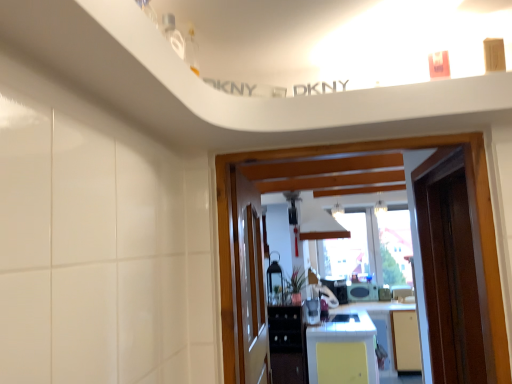
Measure the distance between point (313, 303) and camera.

16.98 feet.

Identify the location of wooden door at center, the second door positioned from the right. This screenshot has height=384, width=512. (249, 282).

The width and height of the screenshot is (512, 384). What do you see at coordinates (275, 282) in the screenshot?
I see `metallic lantern at center, which is the third appliance from back to front` at bounding box center [275, 282].

Where is `white glossy exhaust hood at upper center`? white glossy exhaust hood at upper center is located at coordinates (319, 223).

Locate an element on the screen. The image size is (512, 384). metallic silver toaster at center, acting as the 2th appliance starting from the right is located at coordinates (337, 288).

The image size is (512, 384). In order to click on yellow matte countertop at center in this screenshot , I will do `click(343, 350)`.

Locate an element on the screen. metallic silver toaster at center, which is the first appliance in front-to-back order is located at coordinates (312, 311).

Considering their positions, is matte black microwave at center, positioned as the 1th appliance in right-to-left order, located in front of or behind metallic lantern at center, the second appliance viewed from the front?

matte black microwave at center, positioned as the 1th appliance in right-to-left order, is behind metallic lantern at center, the second appliance viewed from the front.

Which object is positioned more to the right, matte black microwave at center, the first appliance viewed from the back, or metallic lantern at center, the 1th appliance in the left-to-right sequence?

matte black microwave at center, the first appliance viewed from the back.

Looking at this image, from the image's perspective, would you say matte black microwave at center, the first appliance viewed from the back, is positioned over metallic lantern at center, the 1th appliance in the left-to-right sequence?

No, from the image's perspective, matte black microwave at center, the first appliance viewed from the back, is not above metallic lantern at center, the 1th appliance in the left-to-right sequence.

Is matte black microwave at center, positioned as the 1th appliance in right-to-left order, positioned beyond the bounds of metallic lantern at center, which is the third appliance from back to front?

That's correct, matte black microwave at center, positioned as the 1th appliance in right-to-left order, is outside of metallic lantern at center, which is the third appliance from back to front.

Looking at this image, is white glossy exhaust hood at upper center to the left of yellow matte countertop at center from the viewer's perspective?

Indeed, white glossy exhaust hood at upper center is positioned on the left side of yellow matte countertop at center.

Consider the image. Could you tell me if white glossy exhaust hood at upper center is facing yellow matte countertop at center?

No.

Is point (300, 224) closer or farther from the camera than point (353, 323)?

Point (300, 224).

Who is taller, white glossy exhaust hood at upper center or yellow matte countertop at center?

Standing taller between the two is yellow matte countertop at center.

Which is less distant, (308, 309) or (252, 211)?

The point (252, 211) is in front.

Considering the positions of objects metallic silver toaster at center, arranged as the 4th appliance when viewed from the back, and wooden door at center, the 1th door viewed from the left, in the image provided, who is more to the left, metallic silver toaster at center, arranged as the 4th appliance when viewed from the back, or wooden door at center, the 1th door viewed from the left,?

Positioned to the left is wooden door at center, the 1th door viewed from the left.

Based on the photo, which of these two, metallic silver toaster at center, which is counted as the 2th appliance, starting from the left, or wooden door at center, the 1th door viewed from the left, is thinner?

Thinner between the two is wooden door at center, the 1th door viewed from the left.

Based on the photo, is metallic silver toaster at center, acting as the 3th appliance starting from the right, next to wooden door at center, the 1th door viewed from the left, and touching it?

No, metallic silver toaster at center, acting as the 3th appliance starting from the right, is not making contact with wooden door at center, the 1th door viewed from the left.

Can you confirm if yellow matte countertop at center is taller than metallic lantern at center, the second appliance viewed from the front?

Indeed, yellow matte countertop at center has a greater height compared to metallic lantern at center, the second appliance viewed from the front.

From a real-world perspective, which object stands above the other?

metallic lantern at center, the second appliance viewed from the front, is physically above.

Considering the positions of point (337, 343) and point (267, 291), is point (337, 343) closer or farther from the camera than point (267, 291)?

Point (337, 343) is positioned closer to the camera compared to point (267, 291).

Which is nearer, (344, 288) or (372, 286)?

Point (344, 288).

Considering the relative positions of metallic silver toaster at center, acting as the 2th appliance starting from the right, and matte black microwave at center, which is the fourth appliance from left to right, in the image provided, is metallic silver toaster at center, acting as the 2th appliance starting from the right, to the left or to the right of matte black microwave at center, which is the fourth appliance from left to right,?

From the image, it's evident that metallic silver toaster at center, acting as the 2th appliance starting from the right, is to the left of matte black microwave at center, which is the fourth appliance from left to right.

I want to click on appliance located below the metallic silver toaster at center, the 3th appliance when ordered from front to back (from the image's perspective), so click(362, 292).

From a real-world perspective, who is located higher, black glossy cabinet at center or wooden door at center, the 1th door viewed from the left?

wooden door at center, the 1th door viewed from the left, from a real-world perspective.

Is black glossy cabinet at center turned away from wooden door at center, the 1th door viewed from the left?

black glossy cabinet at center does not have its back to wooden door at center, the 1th door viewed from the left.

Considering the positions of point (273, 345) and point (238, 186), is point (273, 345) closer or farther from the camera than point (238, 186)?

Point (273, 345) appears to be farther away from the viewer than point (238, 186).

Measure the distance from black glossy cabinet at center to wooden door at center, the second door positioned from the right.

black glossy cabinet at center and wooden door at center, the second door positioned from the right, are 2.70 meters apart.

Is matte black microwave at center, placed as the fourth appliance when sorted from front to back, positioned in front of brown wooden door at right, placed as the 2th door when sorted from left to right?

That is False.

Based on the photo, considering the sizes of objects matte black microwave at center, placed as the fourth appliance when sorted from front to back, and brown wooden door at right, acting as the 1th door starting from the right, in the image provided, who is taller, matte black microwave at center, placed as the fourth appliance when sorted from front to back, or brown wooden door at right, acting as the 1th door starting from the right,?

brown wooden door at right, acting as the 1th door starting from the right.

Does matte black microwave at center, placed as the fourth appliance when sorted from front to back, turn towards brown wooden door at right, acting as the 1th door starting from the right?

Yes, matte black microwave at center, placed as the fourth appliance when sorted from front to back, is aimed at brown wooden door at right, acting as the 1th door starting from the right.

Is matte black microwave at center, placed as the fourth appliance when sorted from front to back, not within brown wooden door at right, placed as the 2th door when sorted from left to right?

Yes, matte black microwave at center, placed as the fourth appliance when sorted from front to back, is not within brown wooden door at right, placed as the 2th door when sorted from left to right.

Image resolution: width=512 pixels, height=384 pixels. I want to click on the 3rd appliance to the right of the metallic lantern at center, which is the third appliance from back to front, counting from the anchor's position, so click(x=362, y=292).

The image size is (512, 384). In the image, there is a white glossy exhaust hood at upper center. What are the coordinates of `countertop below it (from a real-world perspective)` in the screenshot? It's located at (343, 350).

When comparing their distances from metallic silver toaster at center, the 3th appliance when ordered from front to back, does metallic lantern at center, which is the third appliance from back to front, or yellow matte countertop at center seem further?

yellow matte countertop at center is further to metallic silver toaster at center, the 3th appliance when ordered from front to back.

Looking at the image, which one is located closer to metallic lantern at center, which is the third appliance from back to front, brown wooden door at right, placed as the 2th door when sorted from left to right, or matte black microwave at center, placed as the fourth appliance when sorted from front to back?

Based on the image, matte black microwave at center, placed as the fourth appliance when sorted from front to back, appears to be nearer to metallic lantern at center, which is the third appliance from back to front.

When comparing their distances from yellow matte countertop at center, does matte black microwave at center, the first appliance viewed from the back, or brown wooden door at right, acting as the 1th door starting from the right, seem further?

The object further to yellow matte countertop at center is brown wooden door at right, acting as the 1th door starting from the right.

Based on the photo, considering their positions, is brown wooden door at right, placed as the 2th door when sorted from left to right, positioned closer to yellow matte countertop at center than white glossy exhaust hood at upper center?

white glossy exhaust hood at upper center is closer to yellow matte countertop at center.

Which object lies further to the anchor point white glossy exhaust hood at upper center, brown wooden door at right, acting as the 1th door starting from the right, or metallic silver toaster at center, which is the first appliance in front-to-back order?

brown wooden door at right, acting as the 1th door starting from the right, is positioned further to the anchor white glossy exhaust hood at upper center.

From the picture: Considering their positions, is black glossy cabinet at center positioned closer to metallic silver toaster at center, marked as the 3th appliance in a left-to-right arrangement, than metallic lantern at center, the 1th appliance in the left-to-right sequence?

metallic lantern at center, the 1th appliance in the left-to-right sequence, is positioned closer to the anchor metallic silver toaster at center, marked as the 3th appliance in a left-to-right arrangement.

Estimate the real-world distances between objects in this image. Which object is closer to white glossy exhaust hood at upper center, matte black microwave at center, positioned as the 1th appliance in right-to-left order, or wooden door at center, the 1th door viewed from the left?

Among the two, matte black microwave at center, positioned as the 1th appliance in right-to-left order, is located nearer to white glossy exhaust hood at upper center.

Consider the image. Based on their spatial positions, is metallic silver toaster at center, arranged as the 4th appliance when viewed from the back, or matte black microwave at center, which is the fourth appliance from left to right, closer to yellow matte countertop at center?

metallic silver toaster at center, arranged as the 4th appliance when viewed from the back, is positioned closer to the anchor yellow matte countertop at center.

Locate an element on the screen. The height and width of the screenshot is (384, 512). cabinetry located between wooden door at center, the second door positioned from the right, and matte black microwave at center, which is the fourth appliance from left to right, in the depth direction is located at coordinates (287, 344).

Find the location of a particular element. Image resolution: width=512 pixels, height=384 pixels. appliance between white glossy exhaust hood at upper center and metallic silver toaster at center, which is counted as the 2th appliance, starting from the left, vertically is located at coordinates (275, 282).

You are a GUI agent. You are given a task and a screenshot of the screen. Output one action in this format:
    pyautogui.click(x=<x>, y=<y>)
    Task: Click on the countertop positioned between wooden door at center, the 1th door viewed from the left, and metallic silver toaster at center, which is the first appliance in front-to-back order, from near to far
    The height and width of the screenshot is (384, 512).
    Given the screenshot: What is the action you would take?
    pyautogui.click(x=343, y=350)

At what (x,y) coordinates should I click in order to perform the action: click on door between wooden door at center, the second door positioned from the right, and metallic lantern at center, which is the third appliance from back to front, along the z-axis. Please return your answer as a coordinate pair (x, y). This screenshot has width=512, height=384. Looking at the image, I should click on (449, 268).